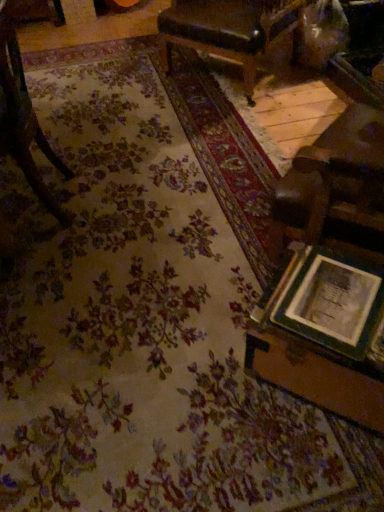
Question: In the image, is wooden table at lower right positioned in front of or behind leather-like brown chair at upper center, acting as the 2th chair starting from the front?

Choices:
 (A) front
 (B) behind

Answer: (A)

Question: In terms of size, does wooden table at lower right appear bigger or smaller than leather-like brown chair at upper center, positioned as the 2th chair in left-to-right order?

Choices:
 (A) big
 (B) small

Answer: (B)

Question: Which object is positioned farthest from the wooden table at lower right?

Choices:
 (A) wooden picture frame at lower right
 (B) leather-like brown chair at upper center, acting as the 2th chair starting from the front
 (C) wooden chair at left, marked as the 2th chair in a right-to-left arrangement

Answer: (B)

Question: Estimate the real-world distances between objects in this image. Which object is closer to the wooden table at lower right?

Choices:
 (A) wooden picture frame at lower right
 (B) wooden chair at left, which is the 1th chair in bottom-to-top order
 (C) leather-like brown chair at upper center, which is the 1th chair from back to front

Answer: (A)